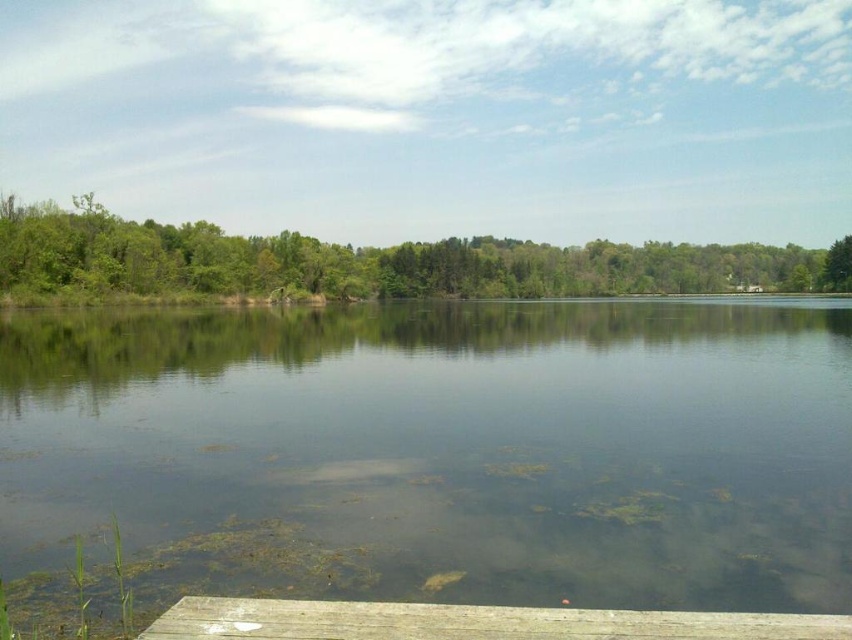
Question: Which point appears farthest from the camera in this image?

Choices:
 (A) (781, 493)
 (B) (361, 272)
 (C) (563, 632)

Answer: (B)

Question: Which object is the closest to the green leafy tree at left?

Choices:
 (A) clear water at center
 (B) wooden dock at lower center

Answer: (A)

Question: Does clear water at center appear under wooden dock at lower center?

Choices:
 (A) no
 (B) yes

Answer: (A)

Question: Which object is the farthest from the green leafy tree at left?

Choices:
 (A) clear water at center
 (B) wooden dock at lower center

Answer: (B)

Question: Is clear water at center positioned before wooden dock at lower center?

Choices:
 (A) yes
 (B) no

Answer: (B)

Question: Considering the relative positions of green leafy tree at left and wooden dock at lower center in the image provided, where is green leafy tree at left located with respect to wooden dock at lower center?

Choices:
 (A) right
 (B) left

Answer: (A)